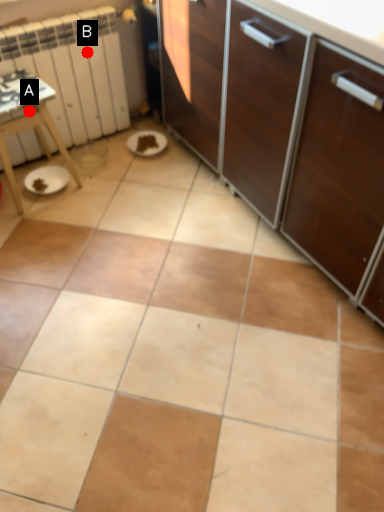
Question: Two points are circled on the image, labeled by A and B beside each circle. Among these points, which one is nearest to the camera?

Choices:
 (A) A is closer
 (B) B is closer

Answer: (A)